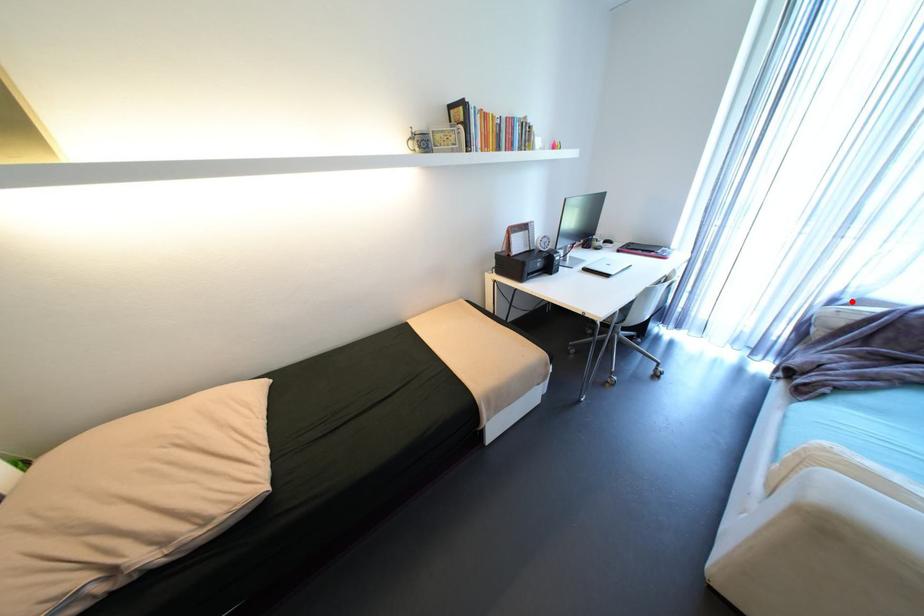
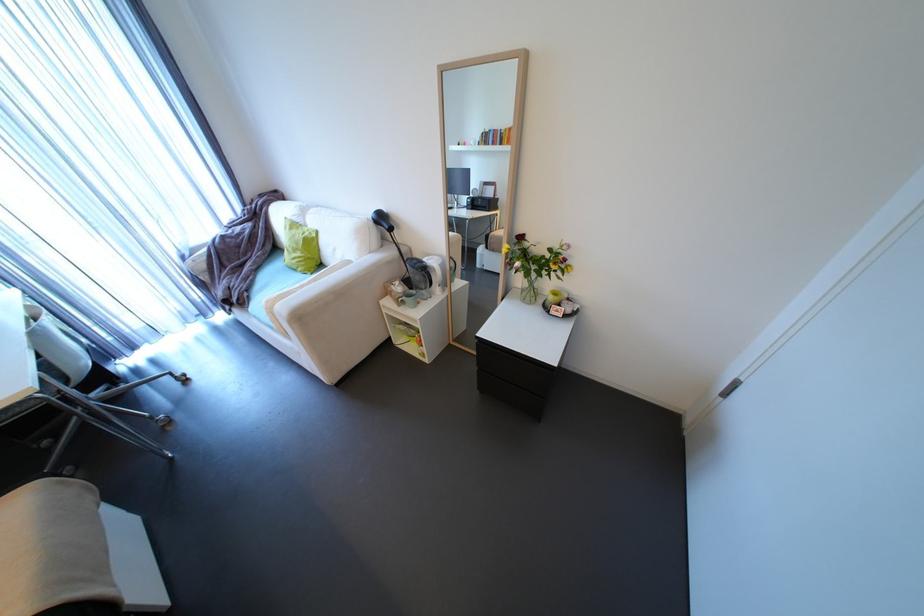
Find the pixel in the second image that matches the highlighted location in the first image.

(195, 254)